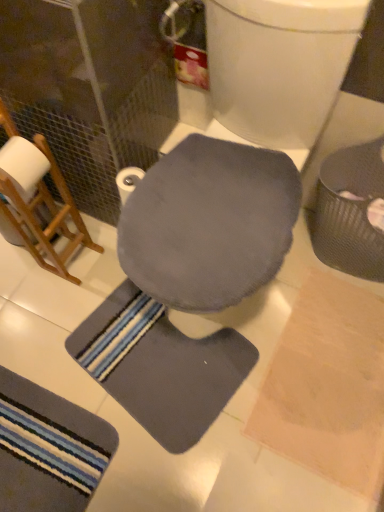
The width and height of the screenshot is (384, 512). Identify the location of empty space that is ontop of gray soft mat at center, acting as the first bath mat starting from the right. (162, 353).